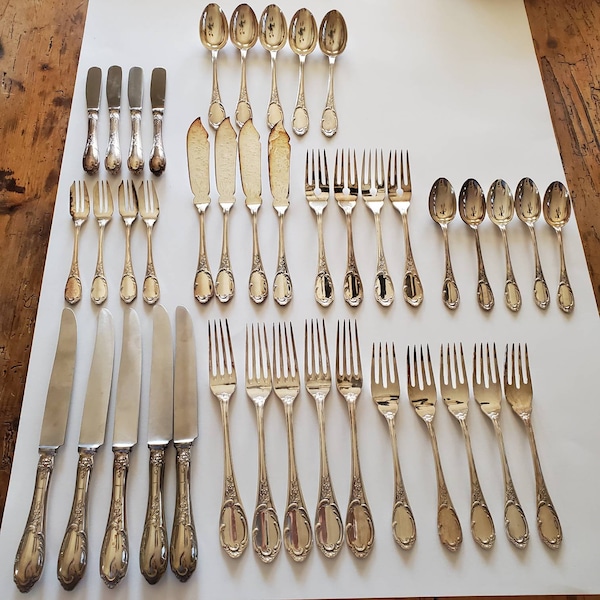
Where is `butter knife`? This screenshot has height=600, width=600. butter knife is located at coordinates (95, 66), (115, 75), (138, 75), (154, 84).